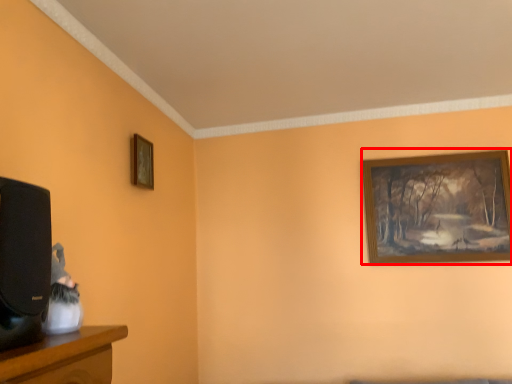
Question: From the image's perspective, where is picture frame (annotated by the red box) located relative to picture frame?

Choices:
 (A) above
 (B) below

Answer: (B)